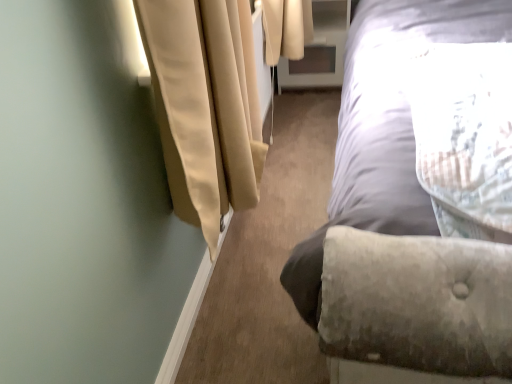
This screenshot has height=384, width=512. I want to click on velvet gray bed at right, so click(396, 207).

Image resolution: width=512 pixels, height=384 pixels. Describe the element at coordinates (396, 207) in the screenshot. I see `velvet gray bed at right` at that location.

What is the approximate width of velvet gray bed at right?

It is 8.26 feet.

Image resolution: width=512 pixels, height=384 pixels. Describe the element at coordinates (320, 49) in the screenshot. I see `clear glass screen door at upper center` at that location.

Locate an element on the screen. clear glass screen door at upper center is located at coordinates (320, 49).

You are a GUI agent. You are given a task and a screenshot of the screen. Output one action in this format:
    pyautogui.click(x=<x>, y=<y>)
    Task: Click on the velvet gray bed at right
    This screenshot has width=512, height=384.
    Given the screenshot: What is the action you would take?
    pyautogui.click(x=396, y=207)

Between velvet gray bed at right and clear glass screen door at upper center, which one appears on the right side from the viewer's perspective?

Positioned to the right is velvet gray bed at right.

Is the position of velvet gray bed at right less distant than that of clear glass screen door at upper center?

Yes.

Does point (432, 22) come farther from viewer compared to point (295, 78)?

No, it is not.

From the image's perspective, does velvet gray bed at right appear lower than clear glass screen door at upper center?

Yes, from the image's perspective, velvet gray bed at right is below clear glass screen door at upper center.

From a real-world perspective, does velvet gray bed at right stand above clear glass screen door at upper center?

Indeed, from a real-world perspective, velvet gray bed at right stands above clear glass screen door at upper center.

Considering the sizes of objects velvet gray bed at right and clear glass screen door at upper center in the image provided, who is wider, velvet gray bed at right or clear glass screen door at upper center?

With larger width is velvet gray bed at right.

Who is shorter, velvet gray bed at right or clear glass screen door at upper center?

clear glass screen door at upper center.

Is velvet gray bed at right smaller than clear glass screen door at upper center?

Actually, velvet gray bed at right might be larger than clear glass screen door at upper center.

Is velvet gray bed at right outside of clear glass screen door at upper center?

Indeed, velvet gray bed at right is completely outside clear glass screen door at upper center.

Is velvet gray bed at right placed right next to clear glass screen door at upper center?

There is a gap between velvet gray bed at right and clear glass screen door at upper center.

Could you tell me if velvet gray bed at right is facing clear glass screen door at upper center?

No, velvet gray bed at right is not turned towards clear glass screen door at upper center.

What's the angular difference between velvet gray bed at right and clear glass screen door at upper center's facing directions?

The angular difference between velvet gray bed at right and clear glass screen door at upper center is 1.09 degrees.

Locate an element on the screen. The height and width of the screenshot is (384, 512). bed to the right of clear glass screen door at upper center is located at coordinates (396, 207).

Considering the positions of objects clear glass screen door at upper center and velvet gray bed at right in the image provided, who is more to the right, clear glass screen door at upper center or velvet gray bed at right?

velvet gray bed at right.

Is clear glass screen door at upper center in front of or behind velvet gray bed at right in the image?

clear glass screen door at upper center is behind velvet gray bed at right.

Is point (316, 75) closer to viewer compared to point (390, 270)?

No.

From the image's perspective, which one is positioned higher, clear glass screen door at upper center or velvet gray bed at right?

clear glass screen door at upper center is shown above in the image.

From a real-world perspective, relative to velvet gray bed at right, is clear glass screen door at upper center vertically above or below?

clear glass screen door at upper center is situated lower than velvet gray bed at right in the real world.

Can you confirm if clear glass screen door at upper center is wider than velvet gray bed at right?

No.

Does clear glass screen door at upper center have a greater height compared to velvet gray bed at right?

In fact, clear glass screen door at upper center may be shorter than velvet gray bed at right.

Considering the sizes of clear glass screen door at upper center and velvet gray bed at right in the image, is clear glass screen door at upper center bigger or smaller than velvet gray bed at right?

Clearly, clear glass screen door at upper center is smaller in size than velvet gray bed at right.

Can we say clear glass screen door at upper center lies outside velvet gray bed at right?

Yes.

Is clear glass screen door at upper center next to velvet gray bed at right?

There is a gap between clear glass screen door at upper center and velvet gray bed at right.

In the scene shown: Is clear glass screen door at upper center looking in the opposite direction of velvet gray bed at right?

No.

What's the angular difference between clear glass screen door at upper center and velvet gray bed at right's facing directions?

The angular difference between clear glass screen door at upper center and velvet gray bed at right is 1.09 degrees.

You are a GUI agent. You are given a task and a screenshot of the screen. Output one action in this format:
    pyautogui.click(x=<x>, y=<y>)
    Task: Click on the bed that appears on the right of clear glass screen door at upper center
    
    Given the screenshot: What is the action you would take?
    pyautogui.click(x=396, y=207)

Find the location of a particular element. The height and width of the screenshot is (384, 512). screen door to the left of velvet gray bed at right is located at coordinates (320, 49).

In the image, there is a clear glass screen door at upper center. Where is `bed below it (from the image's perspective)`? bed below it (from the image's perspective) is located at coordinates (396, 207).